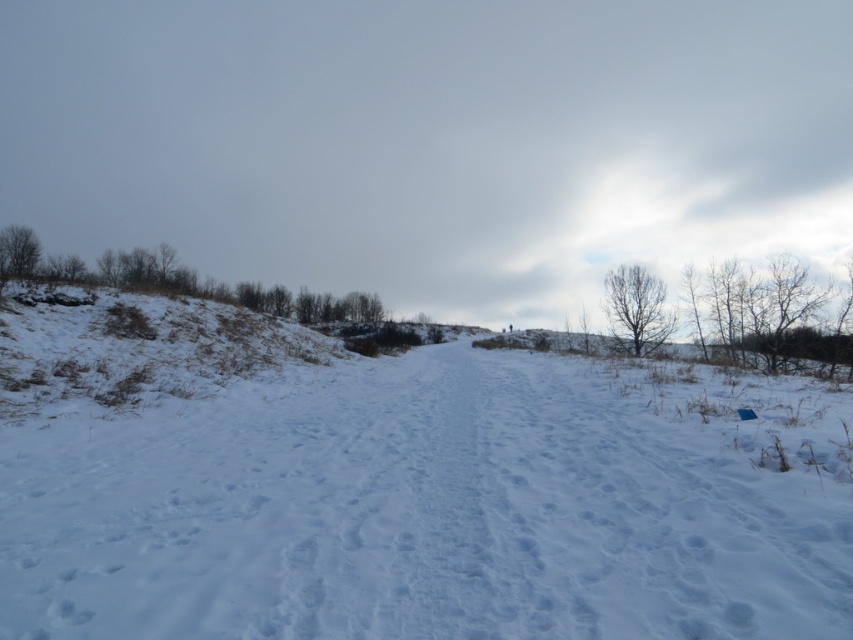
Looking at this image, is white fluffy snow at center positioned behind brown grassy hillside at left?

No, it is in front of brown grassy hillside at left.

Which is behind, point (502, 456) or point (107, 321)?

The point (107, 321) is more distant.

At what (x,y) coordinates should I click in order to perform the action: click on white fluffy snow at center. Please return your answer as a coordinate pair (x, y). Looking at the image, I should click on (434, 506).